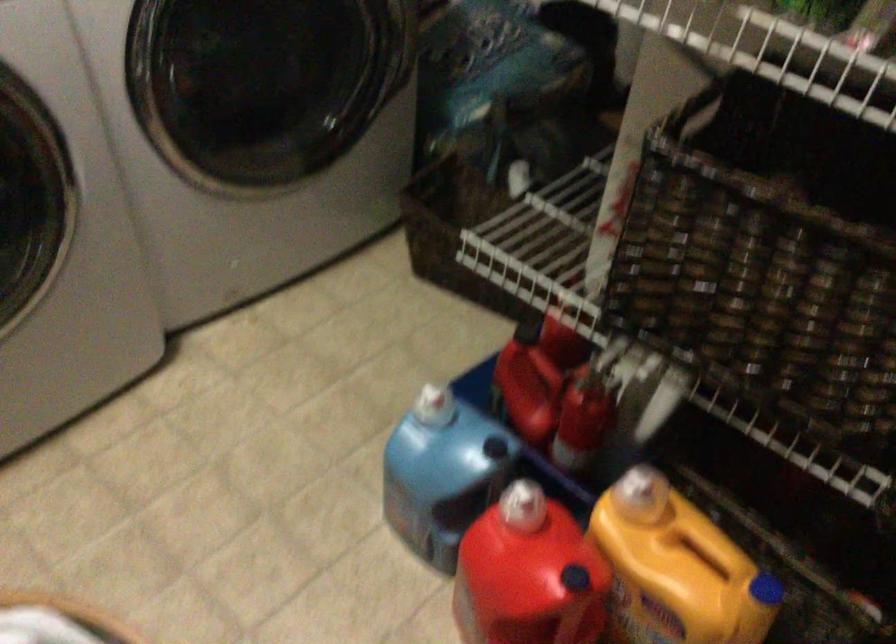
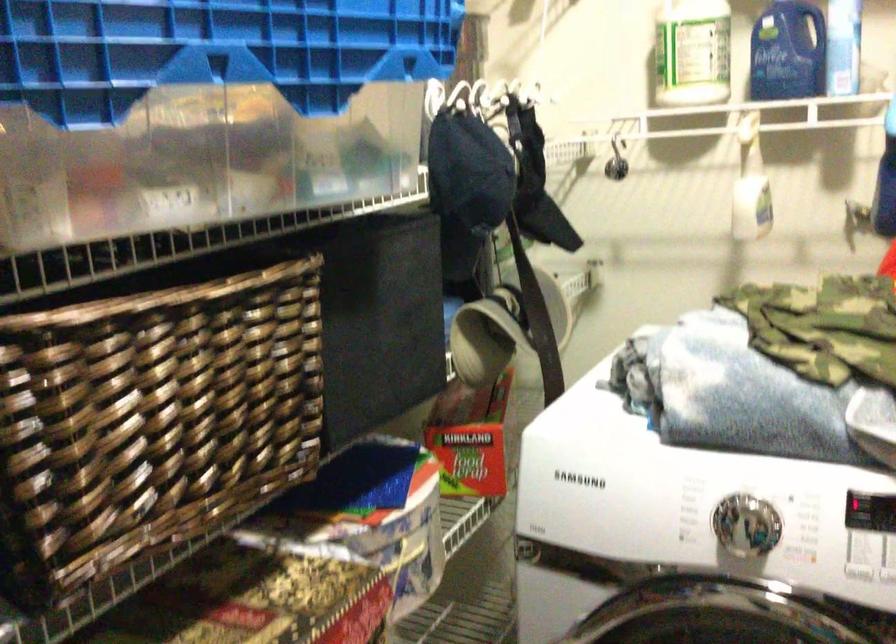
Question: How did the camera likely rotate?

Choices:
 (A) Left
 (B) Right
 (C) Up
 (D) Down

Answer: (A)